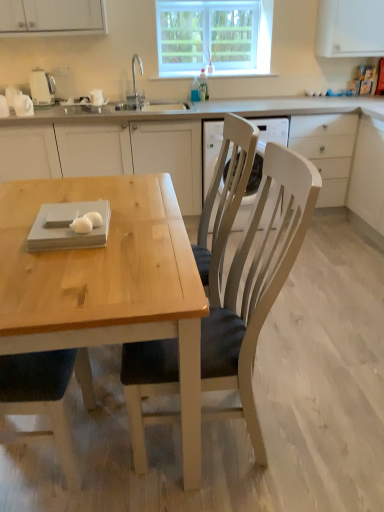
Where is `free area below wooden chair at center (from a real-world perspective)`? free area below wooden chair at center (from a real-world perspective) is located at coordinates (219, 440).